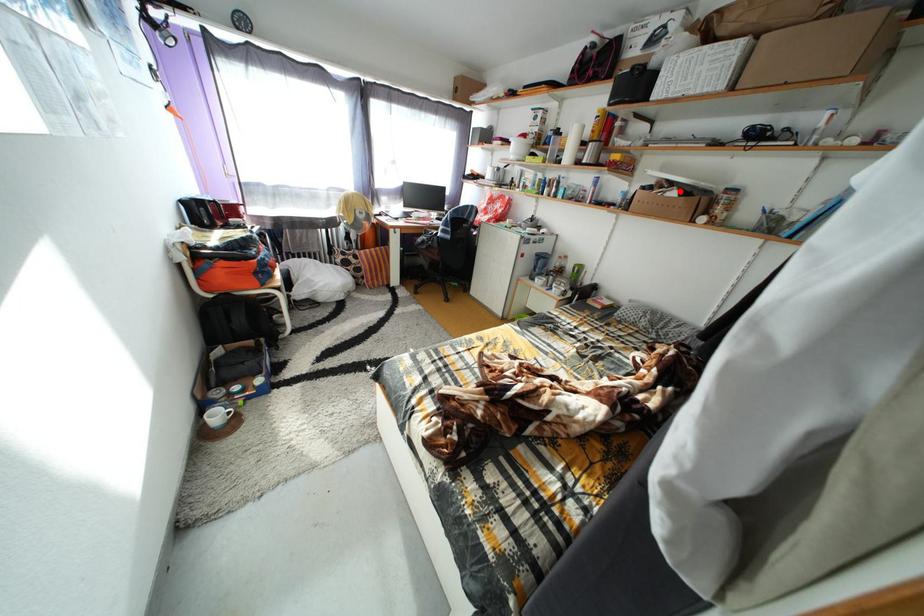
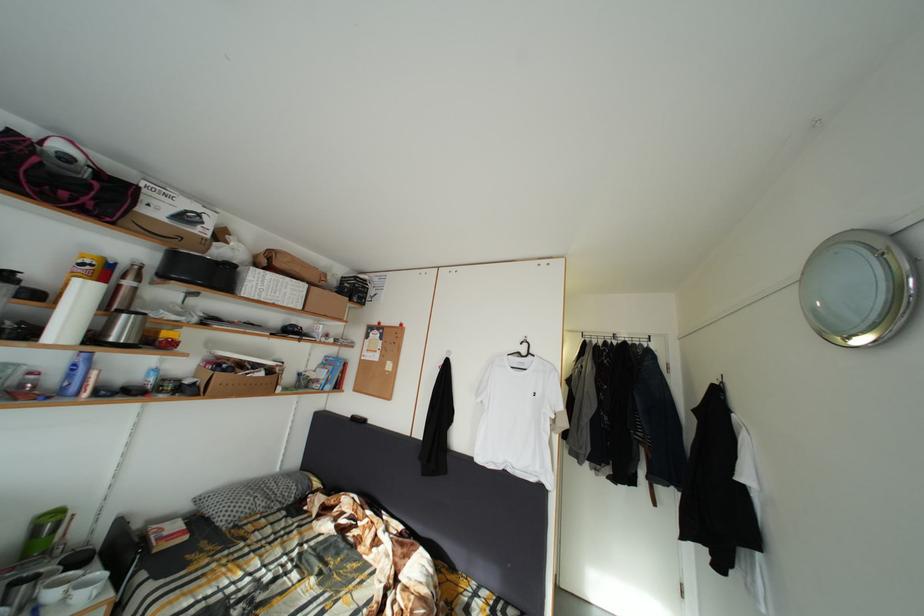
Where in the second image is the point corresponding to the highlighted location from the first image?

(264, 373)